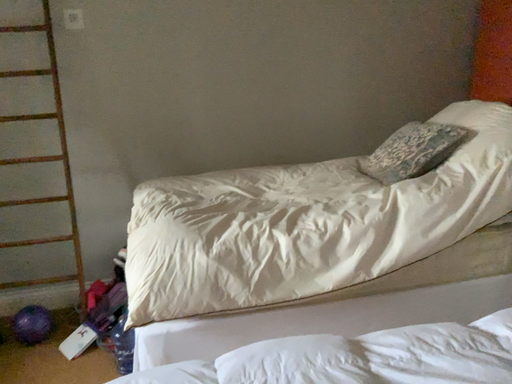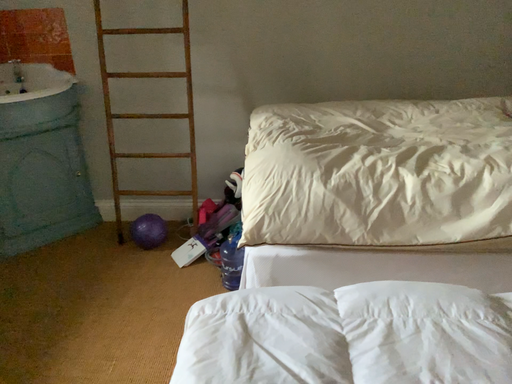
Question: How did the camera likely rotate when shooting the video?

Choices:
 (A) rotated right
 (B) rotated left

Answer: (B)